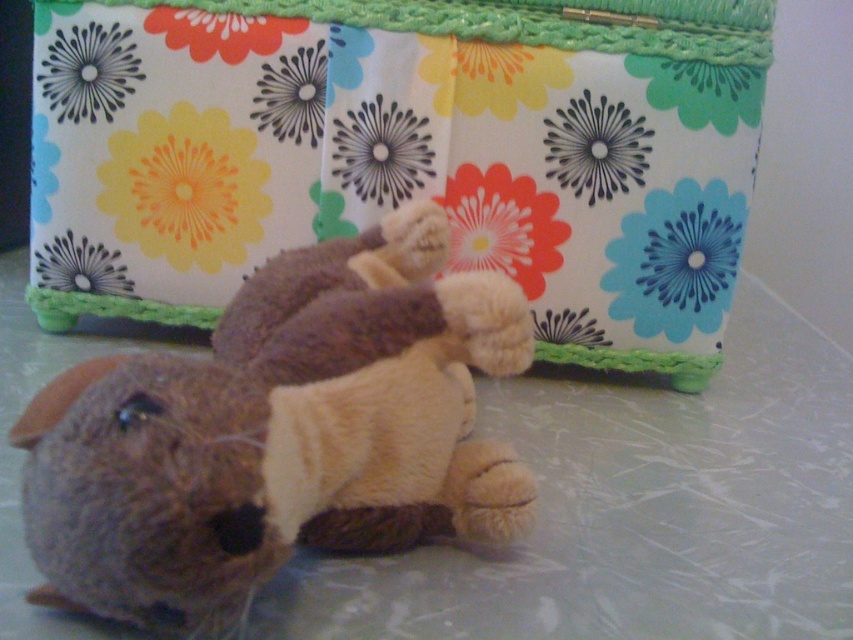
Consider the image. You are an interior designer trying to place a new lamp exactly at the center of the room. You have a reference point marked at point (405, 154). Can you determine if the floral fabric box at upper center is exactly at this reference point?

Yes, the floral fabric box at upper center is located at point (405, 154), so it is exactly at the reference point.

You are standing in front of the image and want to determine the spatial relationship between the two points. Which point is closer to you, point (51, 131) or point (253, 500)?

Point (253, 500) is closer to you because point (51, 131) is behind it.